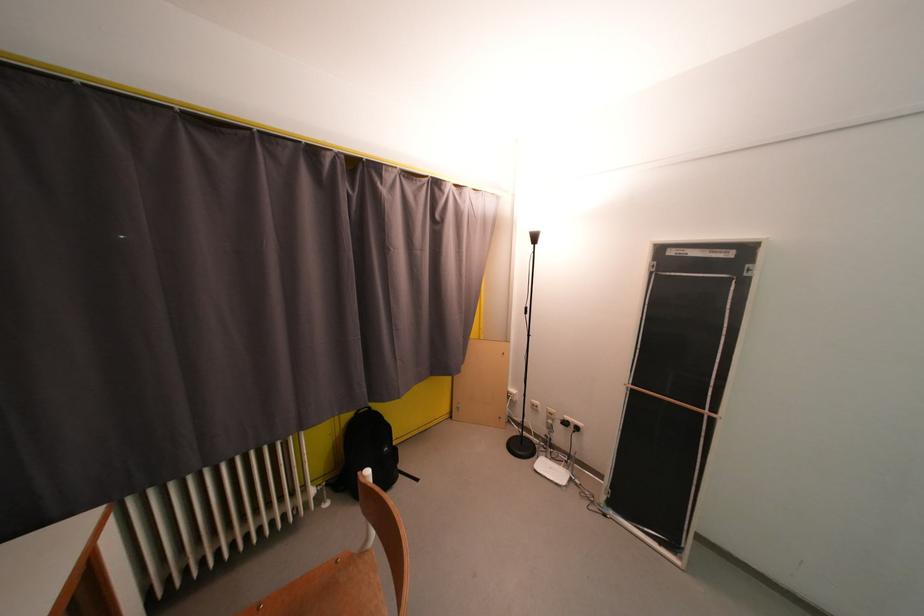
What do you see at coordinates (331, 590) in the screenshot? The height and width of the screenshot is (616, 924). I see `the chair sitting surface` at bounding box center [331, 590].